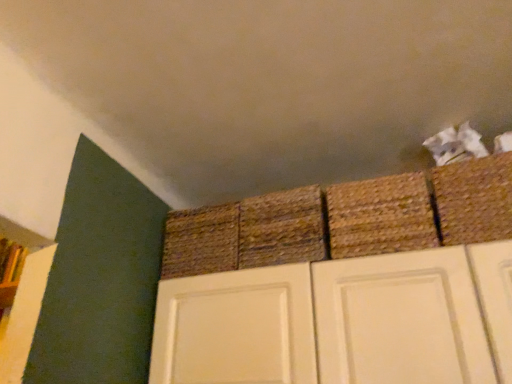
This screenshot has height=384, width=512. Find the location of `braided straw basket at upper right, which is the fourth basket in left-to-right order`. braided straw basket at upper right, which is the fourth basket in left-to-right order is located at coordinates (474, 200).

Describe the element at coordinates (380, 216) in the screenshot. The height and width of the screenshot is (384, 512). I see `rustic woven basket at upper right, positioned as the 2th basket in right-to-left order` at that location.

Describe the element at coordinates (201, 241) in the screenshot. I see `woven straw basket at center, arranged as the 4th basket when viewed from the right` at that location.

Find the location of a particular element. The width and height of the screenshot is (512, 384). braided straw basket at upper right, which is the fourth basket in left-to-right order is located at coordinates (474, 200).

Is wooden shelf at left far from braided straw basket at upper right, which is the fourth basket in left-to-right order?

Yes.

At what (x,y) coordinates should I click in order to perform the action: click on shelf above the braided straw basket at upper right, which is the fourth basket in left-to-right order (from a real-world perspective). Please return your answer as a coordinate pair (x, y). The height and width of the screenshot is (384, 512). Looking at the image, I should click on (10, 270).

Based on their sizes in the image, would you say wooden shelf at left is bigger or smaller than braided straw basket at upper right, the first basket in the right-to-left sequence?

In the image, wooden shelf at left appears to be smaller than braided straw basket at upper right, the first basket in the right-to-left sequence.

From a real-world perspective, relative to braided straw basket at upper right, the first basket in the right-to-left sequence, is wooden shelf at left vertically above or below?

wooden shelf at left is situated higher than braided straw basket at upper right, the first basket in the right-to-left sequence, in the real world.

Based on their positions, is braided straw basket at upper right, which is the fourth basket in left-to-right order, located to the left or right of rustic woven basket at center, positioned as the 2th basket in left-to-right order?

Based on their positions, braided straw basket at upper right, which is the fourth basket in left-to-right order, is located to the right of rustic woven basket at center, positioned as the 2th basket in left-to-right order.

Can you tell me how much braided straw basket at upper right, which is the fourth basket in left-to-right order, and rustic woven basket at center, positioned as the 2th basket in left-to-right order, differ in facing direction?

The angle between the facing direction of braided straw basket at upper right, which is the fourth basket in left-to-right order, and the facing direction of rustic woven basket at center, positioned as the 2th basket in left-to-right order, is 6.16 degrees.

Does point (494, 204) lie behind point (291, 228)?

No, (494, 204) is in front of (291, 228).

From the picture: Is the position of braided straw basket at upper right, which is the fourth basket in left-to-right order, less distant than that of rustic woven basket at center, positioned as the 2th basket in left-to-right order?

Yes, braided straw basket at upper right, which is the fourth basket in left-to-right order, is closer to the camera.

Do you think rustic woven basket at upper right, arranged as the third basket when viewed from the left, is within wooden shelf at left, or outside of it?

rustic woven basket at upper right, arranged as the third basket when viewed from the left, is not enclosed by wooden shelf at left.

Does point (376, 234) lie behind point (13, 263)?

No, (376, 234) is closer to viewer.

From the image's perspective, is rustic woven basket at upper right, arranged as the third basket when viewed from the left, located above wooden shelf at left?

Yes.

From a real-world perspective, between rustic woven basket at center, the third basket from the right, and wooden shelf at left, who is vertically higher?

From a 3D spatial view, wooden shelf at left is above.

Based on the photo, how distant is rustic woven basket at center, the third basket from the right, from wooden shelf at left?

rustic woven basket at center, the third basket from the right, is 3.84 feet from wooden shelf at left.

Which of these two, rustic woven basket at center, the third basket from the right, or wooden shelf at left, is wider?

rustic woven basket at center, the third basket from the right.

From the image's perspective, is rustic woven basket at center, positioned as the 2th basket in left-to-right order, located beneath wooden shelf at left?

Actually, rustic woven basket at center, positioned as the 2th basket in left-to-right order, appears above wooden shelf at left in the image.

Is rustic woven basket at center, the third basket from the right, at the left side of rustic woven basket at upper right, arranged as the third basket when viewed from the left?

Yes.

From a real-world perspective, who is located higher, rustic woven basket at center, the third basket from the right, or rustic woven basket at upper right, positioned as the 2th basket in right-to-left order?

rustic woven basket at center, the third basket from the right, is physically above.

How distant is rustic woven basket at center, positioned as the 2th basket in left-to-right order, from rustic woven basket at upper right, positioned as the 2th basket in right-to-left order?

The distance of rustic woven basket at center, positioned as the 2th basket in left-to-right order, from rustic woven basket at upper right, positioned as the 2th basket in right-to-left order, is 5.90 inches.

Which object is further away from the camera taking this photo, rustic woven basket at center, positioned as the 2th basket in left-to-right order, or rustic woven basket at upper right, arranged as the third basket when viewed from the left?

rustic woven basket at center, positioned as the 2th basket in left-to-right order, is behind.

Can you confirm if woven straw basket at center, arranged as the 1th basket when viewed from the left, is bigger than braided straw basket at upper right, which is the fourth basket in left-to-right order?

Correct, woven straw basket at center, arranged as the 1th basket when viewed from the left, is larger in size than braided straw basket at upper right, which is the fourth basket in left-to-right order.

Are woven straw basket at center, arranged as the 1th basket when viewed from the left, and braided straw basket at upper right, the first basket in the right-to-left sequence, making contact?

No, woven straw basket at center, arranged as the 1th basket when viewed from the left, is not in contact with braided straw basket at upper right, the first basket in the right-to-left sequence.

How different are the orientations of woven straw basket at center, arranged as the 4th basket when viewed from the right, and braided straw basket at upper right, the first basket in the right-to-left sequence, in degrees?

4.5 degrees separate the facing orientations of woven straw basket at center, arranged as the 4th basket when viewed from the right, and braided straw basket at upper right, the first basket in the right-to-left sequence.

Can you confirm if rustic woven basket at center, positioned as the 2th basket in left-to-right order, is shorter than woven straw basket at center, arranged as the 4th basket when viewed from the right?

No.

Can you confirm if rustic woven basket at center, the third basket from the right, is thinner than woven straw basket at center, arranged as the 1th basket when viewed from the left?

Incorrect, the width of rustic woven basket at center, the third basket from the right, is not less than that of woven straw basket at center, arranged as the 1th basket when viewed from the left.

Is rustic woven basket at center, the third basket from the right, closer to camera compared to woven straw basket at center, arranged as the 1th basket when viewed from the left?

Yes, the depth of rustic woven basket at center, the third basket from the right, is less than that of woven straw basket at center, arranged as the 1th basket when viewed from the left.

Considering the positions of point (256, 257) and point (197, 274), is point (256, 257) closer or farther from the camera than point (197, 274)?

Clearly, point (256, 257) is closer to the camera than point (197, 274).

In order to click on shelf behind the braided straw basket at upper right, which is the fourth basket in left-to-right order in this screenshot , I will do `click(10, 270)`.

From a real-world perspective, count 2nd baskets downward from the rustic woven basket at center, the third basket from the right, and point to it. Please provide its 2D coordinates.

[(474, 200)]

Consider the image. When comparing their distances from rustic woven basket at center, positioned as the 2th basket in left-to-right order, does wooden shelf at left or woven straw basket at center, arranged as the 1th basket when viewed from the left, seem closer?

woven straw basket at center, arranged as the 1th basket when viewed from the left, is positioned closer to the anchor rustic woven basket at center, positioned as the 2th basket in left-to-right order.

From the image, which object appears to be nearer to rustic woven basket at center, positioned as the 2th basket in left-to-right order, wooden shelf at left or braided straw basket at upper right, the first basket in the right-to-left sequence?

braided straw basket at upper right, the first basket in the right-to-left sequence, is closer to rustic woven basket at center, positioned as the 2th basket in left-to-right order.

Which object lies nearer to the anchor point braided straw basket at upper right, the first basket in the right-to-left sequence, rustic woven basket at center, positioned as the 2th basket in left-to-right order, or rustic woven basket at upper right, positioned as the 2th basket in right-to-left order?

The object closer to braided straw basket at upper right, the first basket in the right-to-left sequence, is rustic woven basket at upper right, positioned as the 2th basket in right-to-left order.

Estimate the real-world distances between objects in this image. Which object is closer to rustic woven basket at upper right, positioned as the 2th basket in right-to-left order, woven straw basket at center, arranged as the 4th basket when viewed from the right, or wooden shelf at left?

woven straw basket at center, arranged as the 4th basket when viewed from the right, lies closer to rustic woven basket at upper right, positioned as the 2th basket in right-to-left order, than the other object.

Which object lies further to the anchor point wooden shelf at left, rustic woven basket at center, positioned as the 2th basket in left-to-right order, or woven straw basket at center, arranged as the 4th basket when viewed from the right?

Based on the image, rustic woven basket at center, positioned as the 2th basket in left-to-right order, appears to be further to wooden shelf at left.

Considering their positions, is rustic woven basket at center, the third basket from the right, positioned closer to woven straw basket at center, arranged as the 4th basket when viewed from the right, than braided straw basket at upper right, the first basket in the right-to-left sequence?

rustic woven basket at center, the third basket from the right, lies closer to woven straw basket at center, arranged as the 4th basket when viewed from the right, than the other object.

Which object lies nearer to the anchor point wooden shelf at left, rustic woven basket at center, the third basket from the right, or rustic woven basket at upper right, arranged as the third basket when viewed from the left?

The object closer to wooden shelf at left is rustic woven basket at center, the third basket from the right.

From the image, which object appears to be farther from rustic woven basket at center, the third basket from the right, woven straw basket at center, arranged as the 4th basket when viewed from the right, or wooden shelf at left?

The object further to rustic woven basket at center, the third basket from the right, is wooden shelf at left.

Find the location of a particular element. The image size is (512, 384). basket between woven straw basket at center, arranged as the 4th basket when viewed from the right, and rustic woven basket at upper right, positioned as the 2th basket in right-to-left order, in the horizontal direction is located at coordinates (282, 228).

Identify the location of basket located between rustic woven basket at center, positioned as the 2th basket in left-to-right order, and braided straw basket at upper right, which is the fourth basket in left-to-right order, in the left-right direction. [x=380, y=216].

The width and height of the screenshot is (512, 384). What are the coordinates of `basket located between wooden shelf at left and rustic woven basket at center, the third basket from the right, in the left-right direction` in the screenshot? It's located at (201, 241).